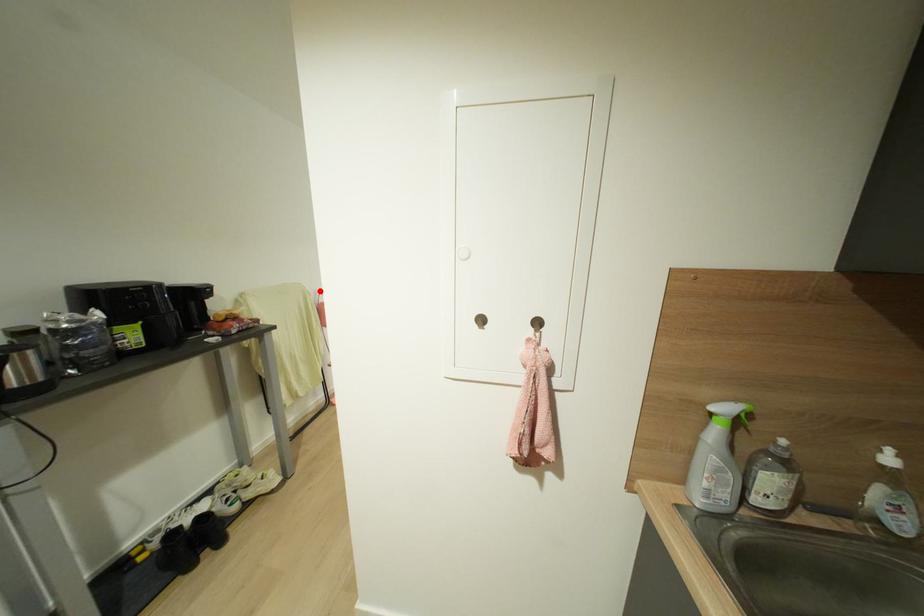
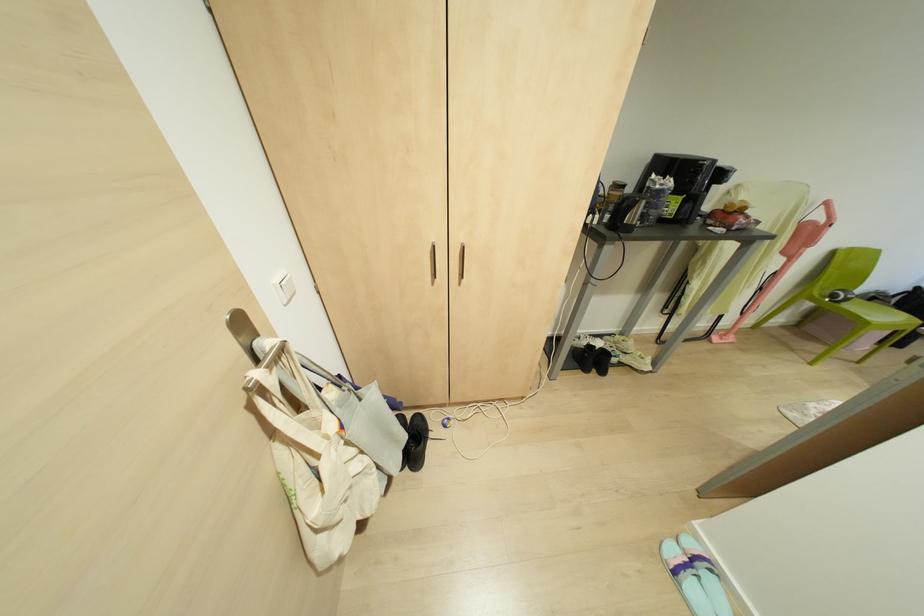
Question: I am providing you with two images of the same scene from different viewpoints. Image1 has a red point marked. In image2, the corresponding 3D location appears at what relative position? Reply with the corresponding letter.

Choices:
 (A) Closer
 (B) Farther

Answer: (A)